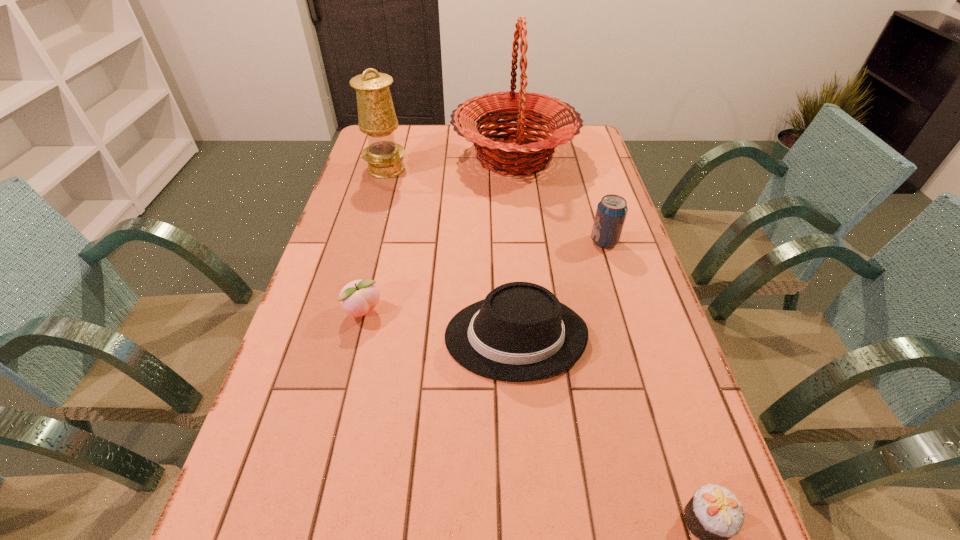
You are a GUI agent. You are given a task and a screenshot of the screen. Output one action in this format:
    pyautogui.click(x=<x>, y=<y>)
    Task: Click on the tallest object
    
    Given the screenshot: What is the action you would take?
    coord(509,156)

The image size is (960, 540). Find the location of `the fifth shortest object`. the fifth shortest object is located at coordinates (377, 118).

This screenshot has height=540, width=960. I want to click on the fourth nearest object, so coord(611,212).

Image resolution: width=960 pixels, height=540 pixels. Identify the location of the third shortest object. (520, 332).

This screenshot has width=960, height=540. Find the location of `the fifth tallest object`. the fifth tallest object is located at coordinates (357, 298).

Locate an element on the screen. free space located 0.100m on the left of the basket is located at coordinates click(x=424, y=157).

Find the location of a particular element. This screenshot has width=960, height=540. blank space located on the back of the oil lamp is located at coordinates (x=396, y=133).

The height and width of the screenshot is (540, 960). What are the coordinates of `free location located 0.260m on the front of the pop soda` in the screenshot? It's located at (629, 322).

Where is `free space located 0.050m on the front-facing side of the third shortest object`? free space located 0.050m on the front-facing side of the third shortest object is located at coordinates (423, 336).

Locate an element on the screen. free space located 0.120m on the front-facing side of the third shortest object is located at coordinates (394, 336).